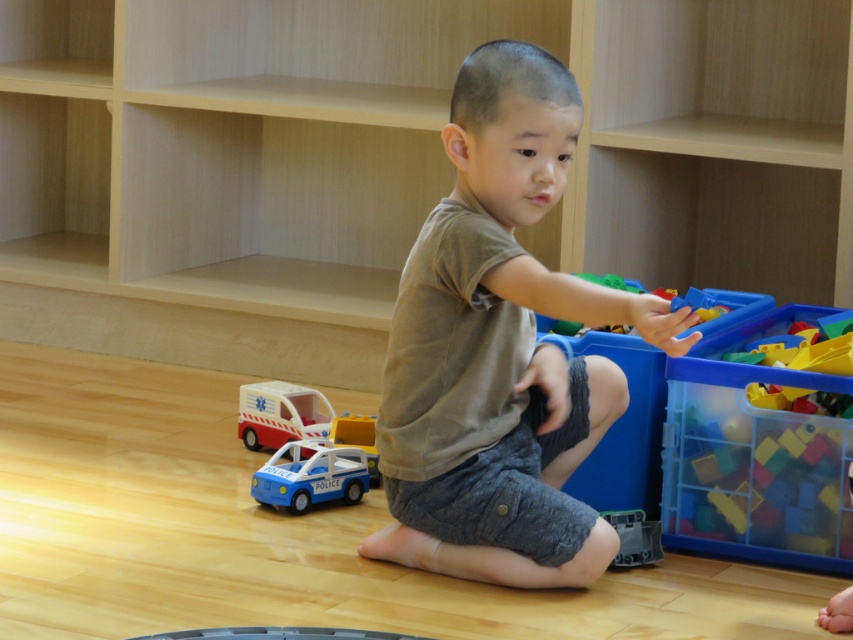
Question: Based on their relative distances, which object is farther from the brown cotton shirt at center?

Choices:
 (A) translucent plastic blocks at right
 (B) blue plastic police car at lower left

Answer: (B)

Question: Does translucent plastic blocks at right lie in front of blue plastic police car at lower left?

Choices:
 (A) yes
 (B) no

Answer: (A)

Question: Does brown cotton shirt at center appear under blue plastic police car at lower left?

Choices:
 (A) no
 (B) yes

Answer: (A)

Question: Can you confirm if translucent plastic blocks at right is positioned to the right of blue plastic police car at lower left?

Choices:
 (A) yes
 (B) no

Answer: (A)

Question: Which of these objects is positioned closest to the brown cotton shirt at center?

Choices:
 (A) translucent plastic blocks at right
 (B) blue plastic police car at lower left

Answer: (A)

Question: Considering the real-world distances, which object is closest to the blue plastic police car at lower left?

Choices:
 (A) brown cotton shirt at center
 (B) translucent plastic blocks at right

Answer: (A)